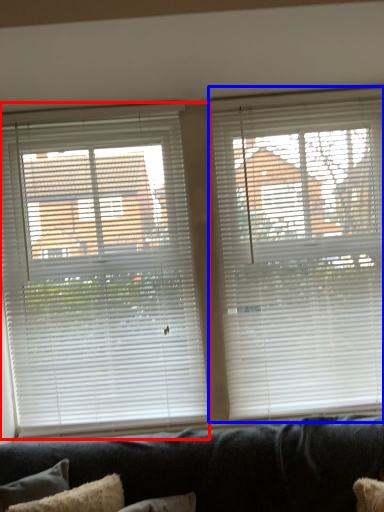
Question: Which of the following is the closest to the observer, window blind (highlighted by a red box) or window blind (highlighted by a blue box)?

Choices:
 (A) window blind
 (B) window blind

Answer: (B)